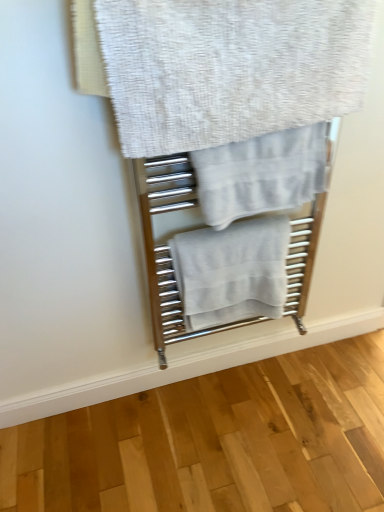
Identify the location of vacant space underneath white textured towel at upper center, marked as the third towel in a bottom-to-top arrangement (from a real-world perspective). (225, 384).